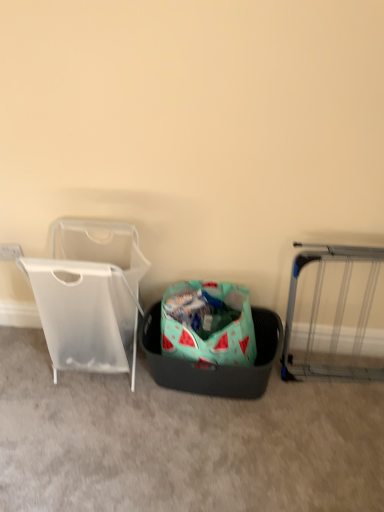
Question: Can we say teal fabric laundry basket at center lies outside silver metallic gate at right?

Choices:
 (A) no
 (B) yes

Answer: (B)

Question: Are teal fabric laundry basket at center and silver metallic gate at right located far from each other?

Choices:
 (A) no
 (B) yes

Answer: (A)

Question: Is teal fabric laundry basket at center next to silver metallic gate at right and touching it?

Choices:
 (A) yes
 (B) no

Answer: (B)

Question: Does teal fabric laundry basket at center have a larger size compared to silver metallic gate at right?

Choices:
 (A) no
 (B) yes

Answer: (B)

Question: Is teal fabric laundry basket at center shorter than silver metallic gate at right?

Choices:
 (A) yes
 (B) no

Answer: (A)

Question: From the image's perspective, is silver metallic gate at right positioned above or below teal fabric laundry basket at center?

Choices:
 (A) below
 (B) above

Answer: (B)

Question: In terms of width, does silver metallic gate at right look wider or thinner when compared to teal fabric laundry basket at center?

Choices:
 (A) wide
 (B) thin

Answer: (B)

Question: From their relative heights in the image, would you say silver metallic gate at right is taller or shorter than teal fabric laundry basket at center?

Choices:
 (A) short
 (B) tall

Answer: (B)

Question: Is silver metallic gate at right inside the boundaries of teal fabric laundry basket at center, or outside?

Choices:
 (A) inside
 (B) outside

Answer: (B)

Question: From a real-world perspective, is transparent plastic laundry basket at left positioned above or below teal fabric laundry basket at center?

Choices:
 (A) above
 (B) below

Answer: (A)

Question: From the image's perspective, is transparent plastic laundry basket at left positioned above or below teal fabric laundry basket at center?

Choices:
 (A) below
 (B) above

Answer: (B)

Question: Based on their sizes in the image, would you say transparent plastic laundry basket at left is bigger or smaller than teal fabric laundry basket at center?

Choices:
 (A) small
 (B) big

Answer: (B)

Question: Relative to teal fabric laundry basket at center, is transparent plastic laundry basket at left in front or behind?

Choices:
 (A) behind
 (B) front

Answer: (B)

Question: Is teal fabric laundry basket at center bigger or smaller than transparent plastic laundry basket at left?

Choices:
 (A) small
 (B) big

Answer: (A)

Question: In terms of height, does teal fabric laundry basket at center look taller or shorter compared to transparent plastic laundry basket at left?

Choices:
 (A) tall
 (B) short

Answer: (B)